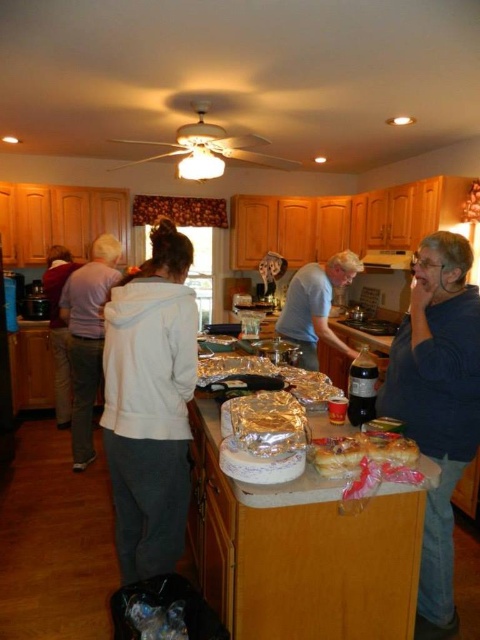
Question: Considering the real-world distances, which object is farthest from the white matte hoodie at center?

Choices:
 (A) white cotton hoodie at center
 (B) blue cotton shirt at right
 (C) golden flaky pie at center
 (D) light blue t-shirt at center

Answer: (A)

Question: Does white matte hoodie at center have a greater width compared to white cotton hoodie at center?

Choices:
 (A) no
 (B) yes

Answer: (A)

Question: Does blue cotton shirt at right lie behind white cotton hoodie at center?

Choices:
 (A) yes
 (B) no

Answer: (B)

Question: Which point appears farthest from the camera in this image?

Choices:
 (A) (435, 314)
 (B) (183, 378)
 (C) (67, 420)
 (D) (327, 465)

Answer: (C)

Question: Does white matte hoodie at center appear under white cotton hoodie at center?

Choices:
 (A) no
 (B) yes

Answer: (B)

Question: Which point is closer to the camera taking this photo?

Choices:
 (A) (319, 264)
 (B) (392, 464)
 (C) (417, 381)

Answer: (B)